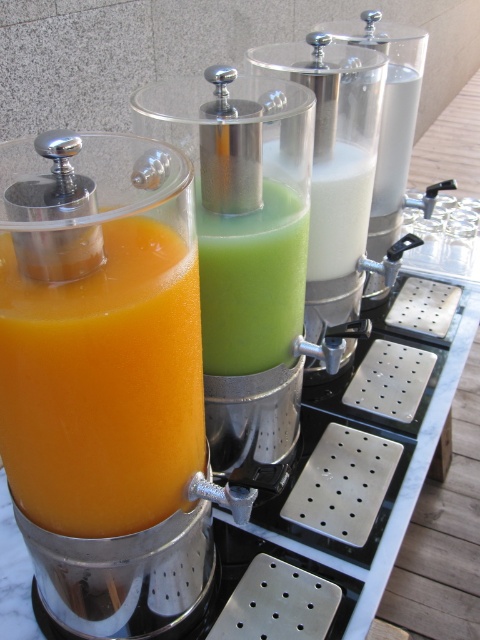
Question: Can you confirm if green matte juice at center is smaller than white matte milkshake at center?

Choices:
 (A) yes
 (B) no

Answer: (A)

Question: Which of the following is the closest to the observer?

Choices:
 (A) (171, 477)
 (B) (204, 272)

Answer: (A)

Question: Does green matte juice at center appear under white matte milkshake at center?

Choices:
 (A) yes
 (B) no

Answer: (A)

Question: Which of the following is the farthest from the observer?

Choices:
 (A) matte orange juice at left
 (B) white matte milkshake at center

Answer: (B)

Question: Does matte orange juice at left appear on the right side of white matte milkshake at center?

Choices:
 (A) no
 (B) yes

Answer: (A)

Question: Which of these objects is positioned closest to the green matte juice at center?

Choices:
 (A) white matte milkshake at center
 (B) matte orange juice at left

Answer: (A)